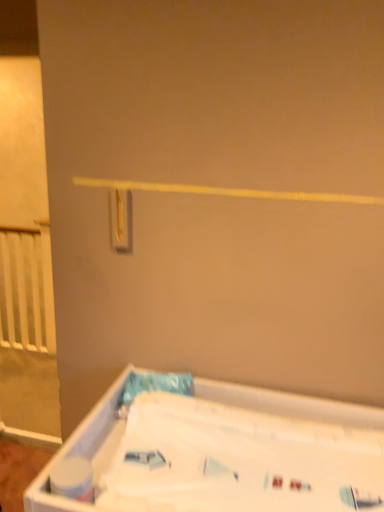
Question: Considering the positions of white plastic bathtub at lower right and gold metallic light switch at upper center in the image, is white plastic bathtub at lower right taller or shorter than gold metallic light switch at upper center?

Choices:
 (A) tall
 (B) short

Answer: (A)

Question: From a real-world perspective, is white plastic bathtub at lower right above or below gold metallic light switch at upper center?

Choices:
 (A) below
 (B) above

Answer: (A)

Question: Based on their relative distances, which object is farther from the white matte toilet paper at lower left?

Choices:
 (A) white plastic bathtub at lower right
 (B) gold metallic light switch at upper center

Answer: (B)

Question: Estimate the real-world distances between objects in this image. Which object is farther from the white plastic bathtub at lower right?

Choices:
 (A) white matte toilet paper at lower left
 (B) gold metallic light switch at upper center

Answer: (B)